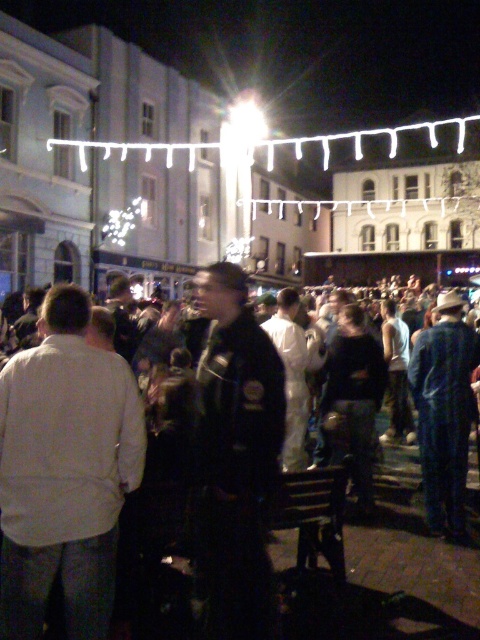
Can you confirm if white matte shirt at center is positioned above blue denim jeans at lower right?

Correct, white matte shirt at center is located above blue denim jeans at lower right.

Is white matte shirt at center shorter than blue denim jeans at lower right?

No, white matte shirt at center is not shorter than blue denim jeans at lower right.

Who is more distant from viewer, (45, 321) or (435, 492)?

The point (435, 492) is more distant.

Identify the location of white matte shirt at center. (64, 472).